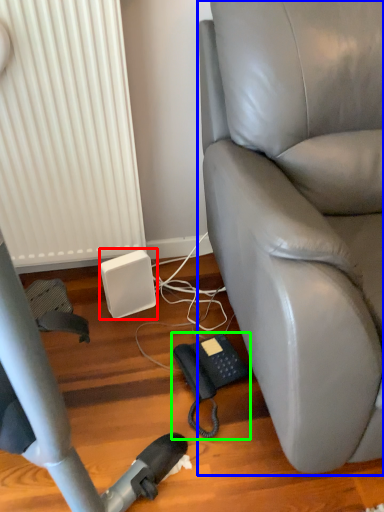
Question: Which object is positioned farthest from speaker (highlighted by a red box)? Select from chair (highlighted by a blue box) and corded phone (highlighted by a green box).

Choices:
 (A) chair
 (B) corded phone

Answer: (A)